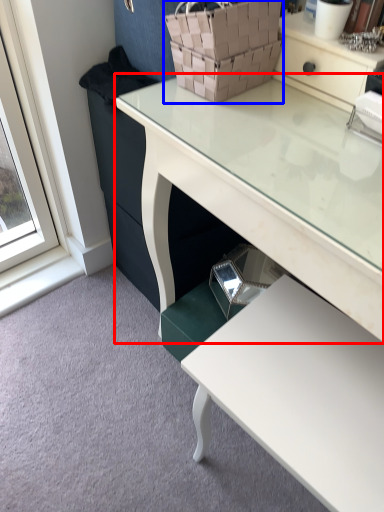
Question: Which of the following is the farthest to the observer, desk (highlighted by a red box) or basket (highlighted by a blue box)?

Choices:
 (A) desk
 (B) basket

Answer: (B)